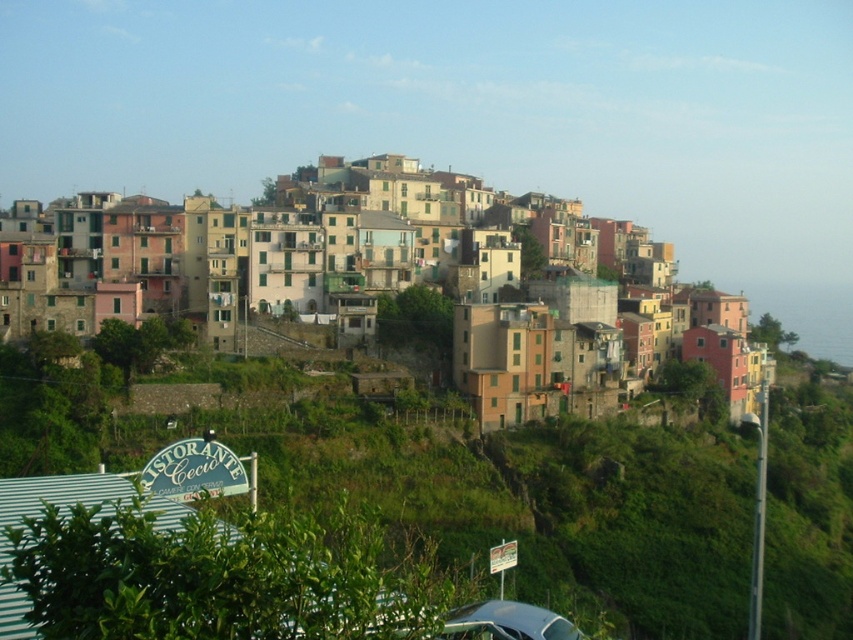
Who is taller, multicolored stone buildings at center or metallic silver car at lower center?

With more height is multicolored stone buildings at center.

Who is positioned more to the left, multicolored stone buildings at center or metallic silver car at lower center?

Positioned to the left is multicolored stone buildings at center.

Is point (273, 284) behind point (531, 621)?

Yes, point (273, 284) is behind point (531, 621).

Locate an element on the screen. multicolored stone buildings at center is located at coordinates (242, 248).